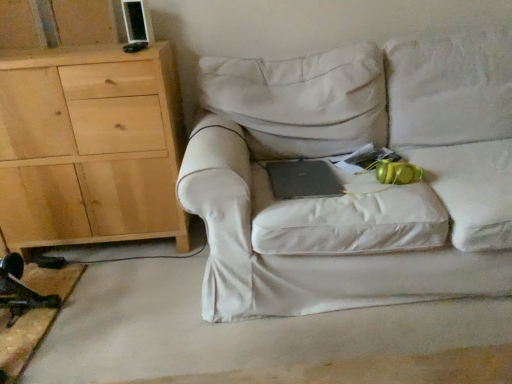
Question: Is black matte laptop at center positioned far away from natural wood cabinet at left?

Choices:
 (A) yes
 (B) no

Answer: (B)

Question: Does black matte laptop at center have a greater width compared to natural wood cabinet at left?

Choices:
 (A) yes
 (B) no

Answer: (B)

Question: Is black matte laptop at center taller than natural wood cabinet at left?

Choices:
 (A) yes
 (B) no

Answer: (B)

Question: Is black matte laptop at center located outside natural wood cabinet at left?

Choices:
 (A) no
 (B) yes

Answer: (B)

Question: Considering the relative sizes of black matte laptop at center and natural wood cabinet at left in the image provided, is black matte laptop at center thinner than natural wood cabinet at left?

Choices:
 (A) yes
 (B) no

Answer: (A)

Question: Is black matte laptop at center at the left side of natural wood cabinet at left?

Choices:
 (A) yes
 (B) no

Answer: (B)

Question: Considering the relative sizes of white fabric couch at center and natural wood cabinet at left in the image provided, is white fabric couch at center taller than natural wood cabinet at left?

Choices:
 (A) yes
 (B) no

Answer: (B)

Question: Is white fabric couch at center not near natural wood cabinet at left?

Choices:
 (A) no
 (B) yes

Answer: (A)

Question: Does white fabric couch at center have a greater width compared to natural wood cabinet at left?

Choices:
 (A) yes
 (B) no

Answer: (A)

Question: Is natural wood cabinet at left located within white fabric couch at center?

Choices:
 (A) no
 (B) yes

Answer: (A)

Question: From a real-world perspective, is white fabric couch at center on natural wood cabinet at left?

Choices:
 (A) yes
 (B) no

Answer: (B)

Question: From the image's perspective, is white fabric couch at center below natural wood cabinet at left?

Choices:
 (A) yes
 (B) no

Answer: (A)

Question: From the image's perspective, would you say white fabric couch at center is shown under black matte laptop at center?

Choices:
 (A) yes
 (B) no

Answer: (B)